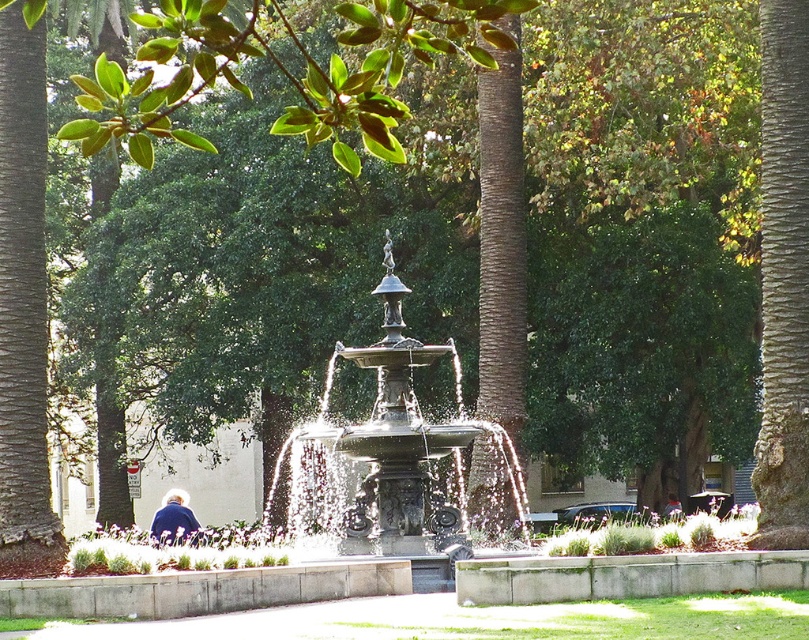
You are a park visitor standing on the paved pathway leading to the fountain. You see the polished bronze fountain at center and the blue fabric jacket at center. Which object is higher in the image?

The polished bronze fountain at center is above the blue fabric jacket at center, so it is higher in the image.

You are a park visitor holding a 20 meter long rope. You want to tie the brown rough bark tree at right to the blue fabric jacket at center to secure something between them. Is the rope long enough for this task?

The brown rough bark tree at right and blue fabric jacket at center are 34.07 meters apart from each other. Since the rope is only 20 meters long, it is not long enough to reach between them.

You are a photographer standing at the entrance of the park. You want to capture a photo that includes both the polished bronze fountain at center and the blue fabric jacket at lower left. Considering their heights, which object will appear larger in the photo?

The polished bronze fountain at center will appear larger in the photo because it is much taller than the blue fabric jacket at lower left.